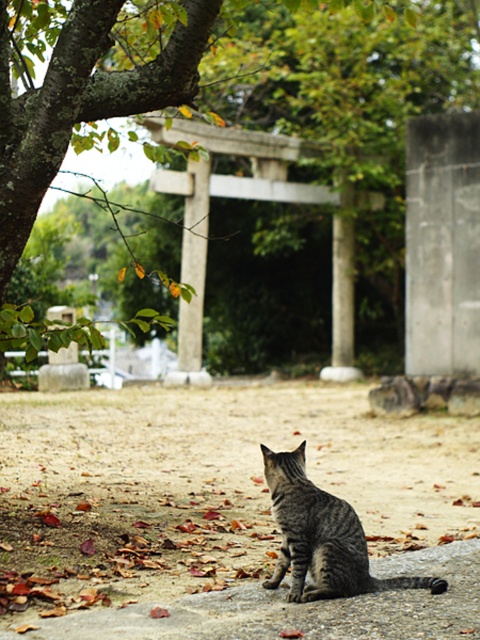
Between smooth concrete stone at center right and gray striped cat at lower center, which one has more height?

smooth concrete stone at center right

Describe the element at coordinates (442, 244) in the screenshot. Image resolution: width=480 pixels, height=640 pixels. I see `smooth concrete stone at center right` at that location.

Is point (446, 232) positioned before point (291, 496)?

That is False.

You are a GUI agent. You are given a task and a screenshot of the screen. Output one action in this format:
    pyautogui.click(x=<x>, y=<y>)
    Task: Click on the smooth concrete stone at center right
    This screenshot has height=640, width=480.
    Given the screenshot: What is the action you would take?
    pyautogui.click(x=442, y=244)